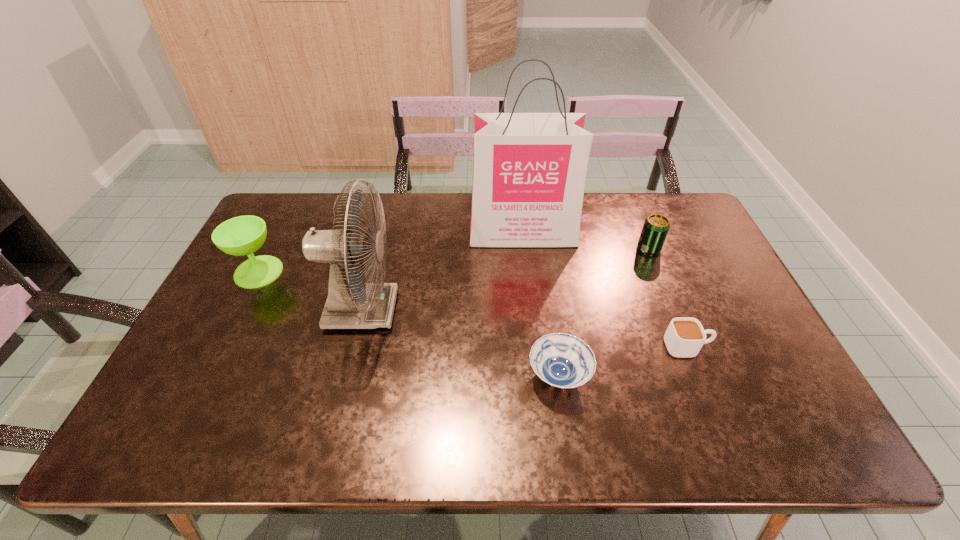
At what (x,y) coordinates should I click in order to perform the action: click on the tallest object. Please return your answer as a coordinate pair (x, y). The width and height of the screenshot is (960, 540). Looking at the image, I should click on coord(529,171).

The width and height of the screenshot is (960, 540). I want to click on fan, so click(x=352, y=303).

I want to click on the fifth shortest object, so click(352, 303).

Where is `the third tallest object`? the third tallest object is located at coordinates (239, 236).

Locate an element on the screen. The image size is (960, 540). the leftmost object is located at coordinates (239, 236).

Image resolution: width=960 pixels, height=540 pixels. In order to click on beer can in this screenshot , I will do `click(655, 229)`.

In order to click on cup in this screenshot , I will do coord(685,336).

Where is `soup bowl`? The image size is (960, 540). soup bowl is located at coordinates tap(562, 360).

Image resolution: width=960 pixels, height=540 pixels. I want to click on free space located on the front-facing side of the tallest object, so click(530, 299).

In order to click on vacant space located on the front-facing side of the second tallest object in this screenshot , I will do `click(459, 310)`.